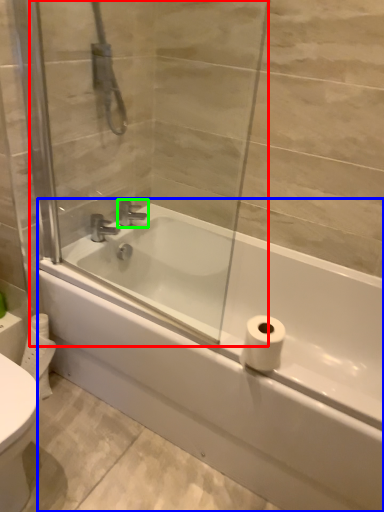
Question: Considering the real-world distances, which object is farthest from screen door (highlighted by a red box)? bathtub (highlighted by a blue box) or tap (highlighted by a green box)?

Choices:
 (A) bathtub
 (B) tap

Answer: (B)